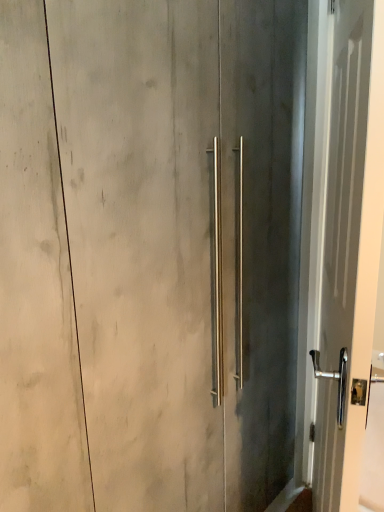
I want to click on satin silver handle at right, so click(x=347, y=240).

Describe the element at coordinates (347, 240) in the screenshot. Image resolution: width=384 pixels, height=512 pixels. I see `satin silver handle at right` at that location.

You are a GUI agent. You are given a task and a screenshot of the screen. Output one action in this format:
    pyautogui.click(x=<x>, y=<y>)
    Task: Click on the satin silver handle at right
    
    Given the screenshot: What is the action you would take?
    coord(347,240)